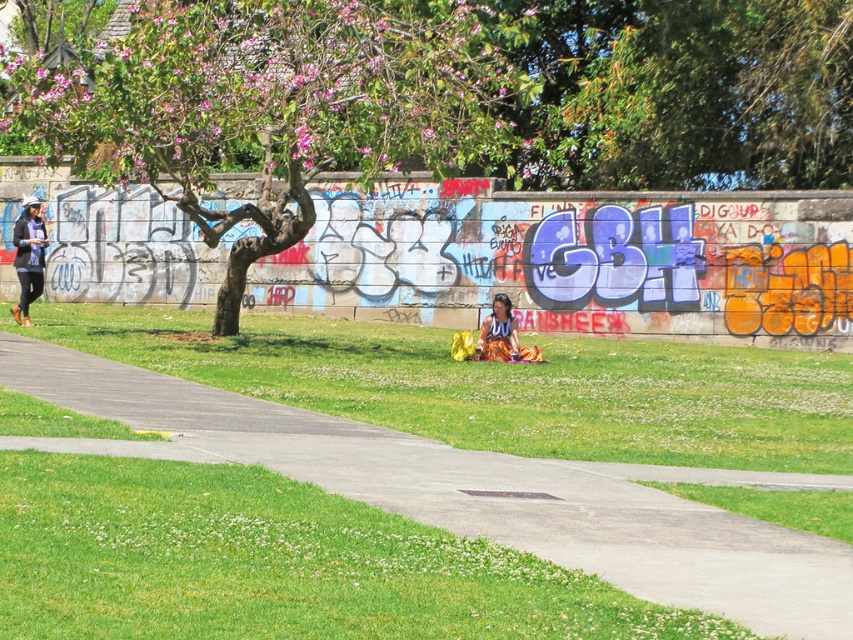
Question: Which point is closer to the camera?

Choices:
 (A) (15, 321)
 (B) (471, 138)
 (C) (666, 579)

Answer: (C)

Question: Which point appears closest to the camera in this image?

Choices:
 (A) [x=494, y=305]
 (B) [x=215, y=86]

Answer: (B)

Question: Which of the following is the farthest from the observer?

Choices:
 (A) (303, 141)
 (B) (21, 272)
 (C) (202, 355)
 (D) (503, 300)

Answer: (B)

Question: Is green grass at center wider than matte black jacket at left?

Choices:
 (A) no
 (B) yes

Answer: (B)

Question: Does pink flowered tree at upper left appear on the left side of gray concrete pavement at center?

Choices:
 (A) yes
 (B) no

Answer: (A)

Question: Is pink flowered tree at upper left wider than multicolored fabric at center?

Choices:
 (A) yes
 (B) no

Answer: (A)